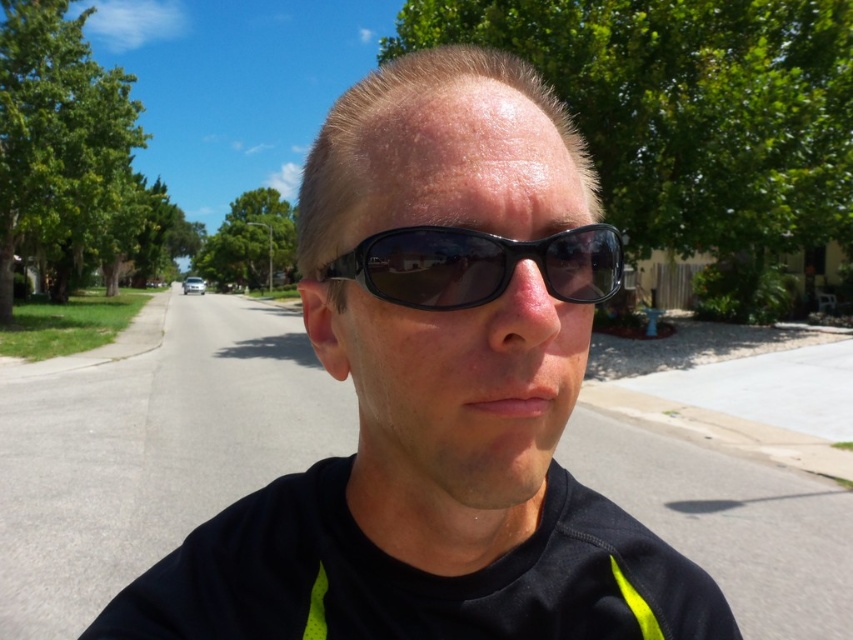
You are designing a billboard that needs to be placed between the black matte sunglasses at center and the white vehicle further down the road. The billboard must be exactly 15 feet wide. Will the space between them accommodate the billboard?

The distance between the black matte sunglasses at center and the white vehicle further down the road is 14.94 inches, which is approximately 1.245 feet. Since the billboard requires 15 feet of width, the space is insufficient to accommodate it.

You are standing at the point with coordinates point (x=579, y=276) and want to walk to the point with coordinates point (x=253, y=548). Based on the image, will you be moving towards the background or the foreground?

Point (x=253, y=548) is behind point (x=579, y=276), so moving towards it means you are walking towards the background.